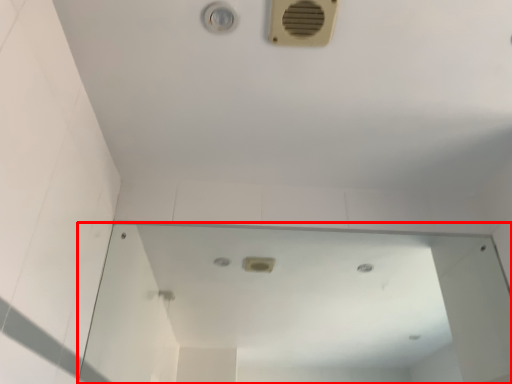
Question: From the image's perspective, where is mirror (annotated by the red box) located relative to air conditioning?

Choices:
 (A) above
 (B) below

Answer: (B)